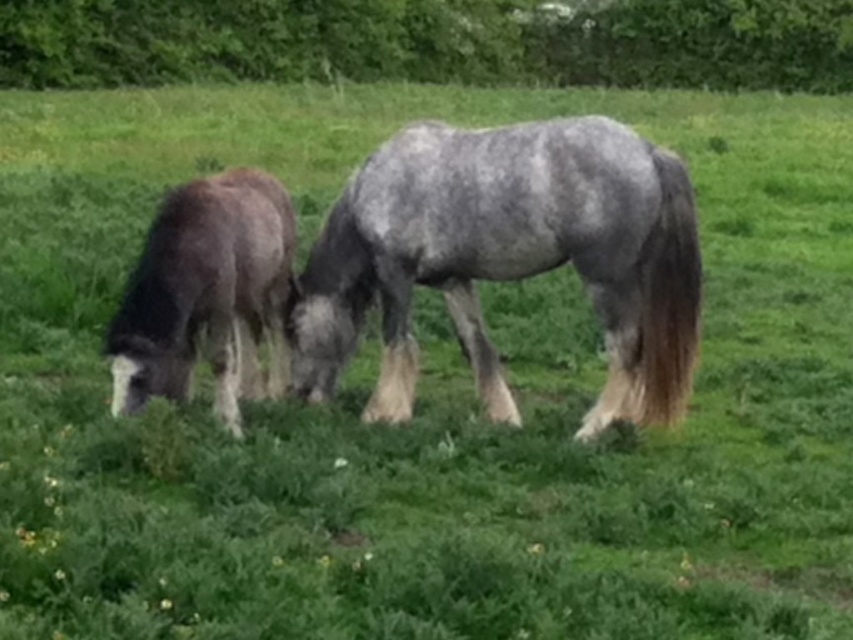
In order to click on speckled gray horse at center in this screenshot , I will do `click(509, 259)`.

Does point (604, 216) come in front of point (219, 396)?

That is True.

The height and width of the screenshot is (640, 853). In order to click on speckled gray horse at center in this screenshot , I will do `click(509, 259)`.